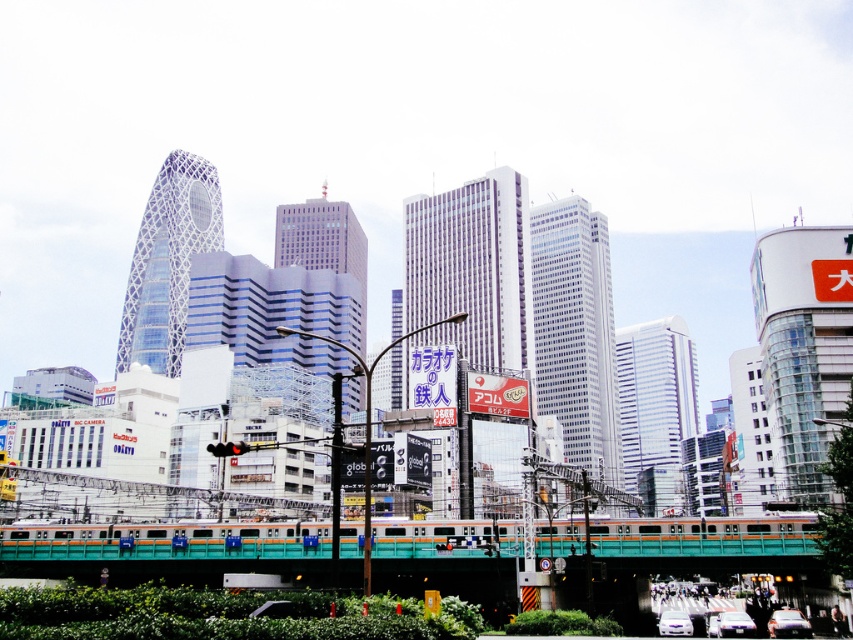
Can you confirm if teal glossy train at center is wider than white glossy car at lower right?

Yes.

Between teal glossy train at center and white glossy car at lower right, which one has more height?

With more height is teal glossy train at center.

The width and height of the screenshot is (853, 640). Describe the element at coordinates (160, 531) in the screenshot. I see `teal glossy train at center` at that location.

What are the coordinates of `teal glossy train at center` in the screenshot? It's located at 160,531.

Does teal glossy train at center appear on the right side of shiny silver sedan at center?

No, teal glossy train at center is not to the right of shiny silver sedan at center.

Does teal glossy train at center have a larger size compared to shiny silver sedan at center?

Indeed, teal glossy train at center has a larger size compared to shiny silver sedan at center.

Is point (592, 520) farther from camera compared to point (740, 612)?

No.

The image size is (853, 640). I want to click on teal glossy train at center, so click(160, 531).

Does white glossy car at lower right have a lesser width compared to shiny silver sedan at center?

No.

Who is higher up, white glossy car at lower right or shiny silver sedan at center?

Positioned higher is white glossy car at lower right.

Locate an element on the screen. white glossy car at lower right is located at coordinates (788, 625).